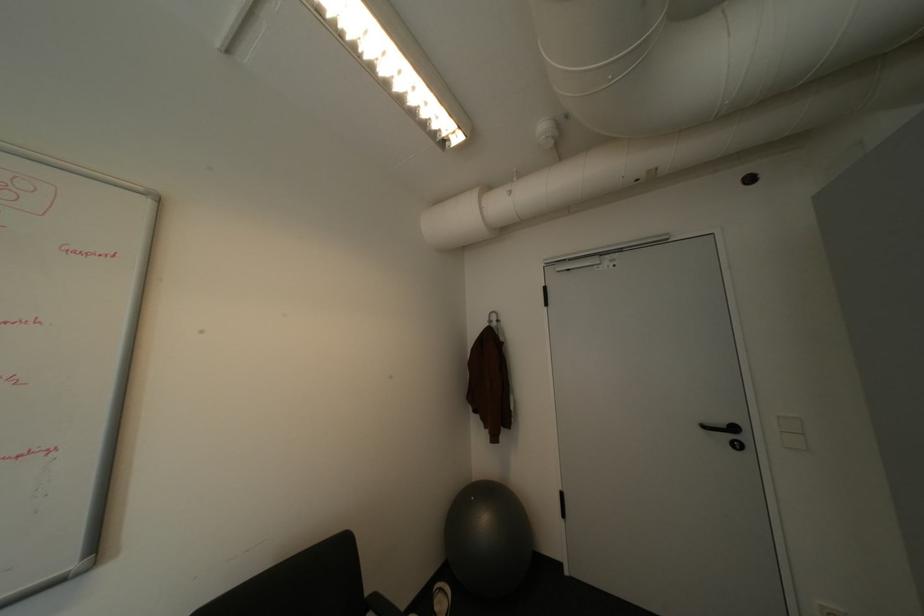
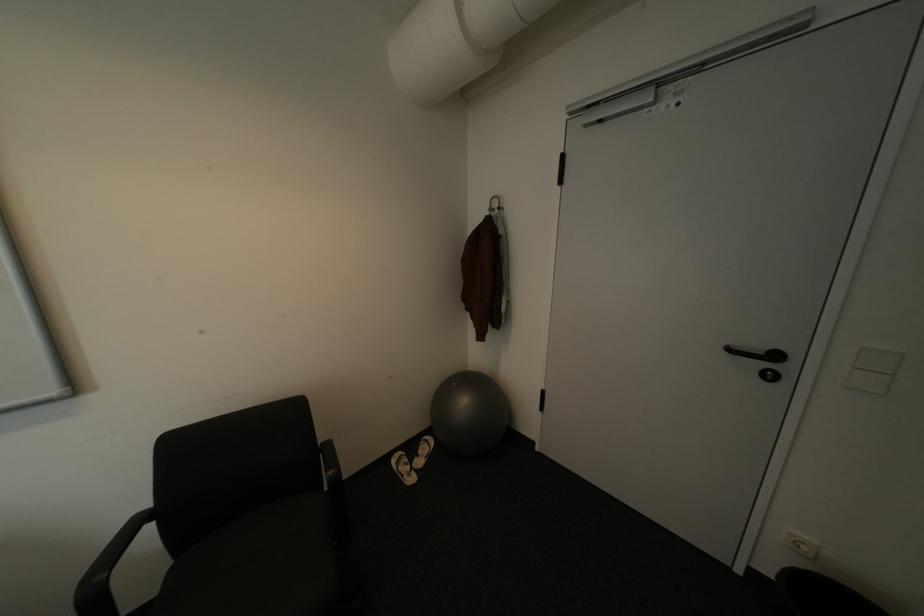
The point at (x=714, y=427) is marked in the first image. Where is the corresponding point in the second image?

(739, 350)